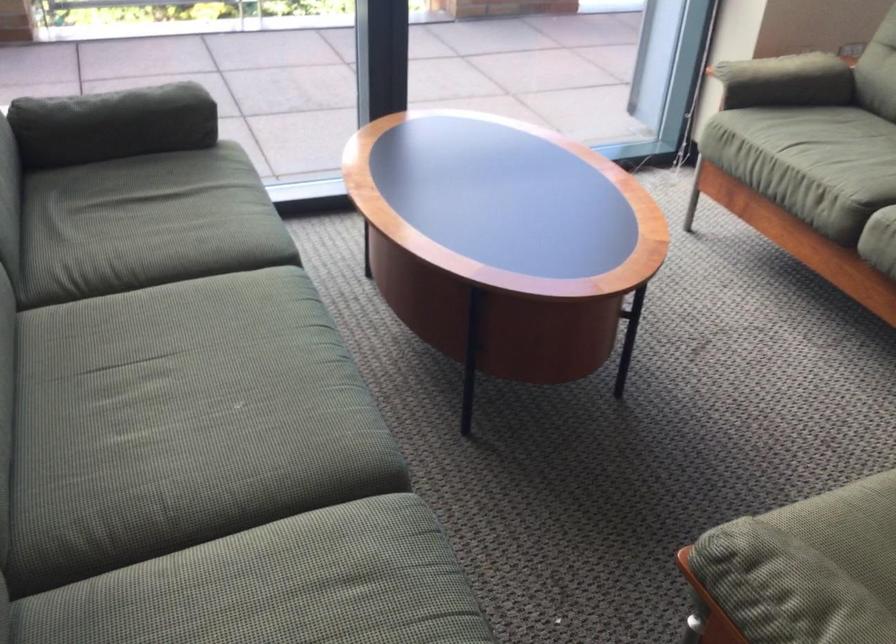
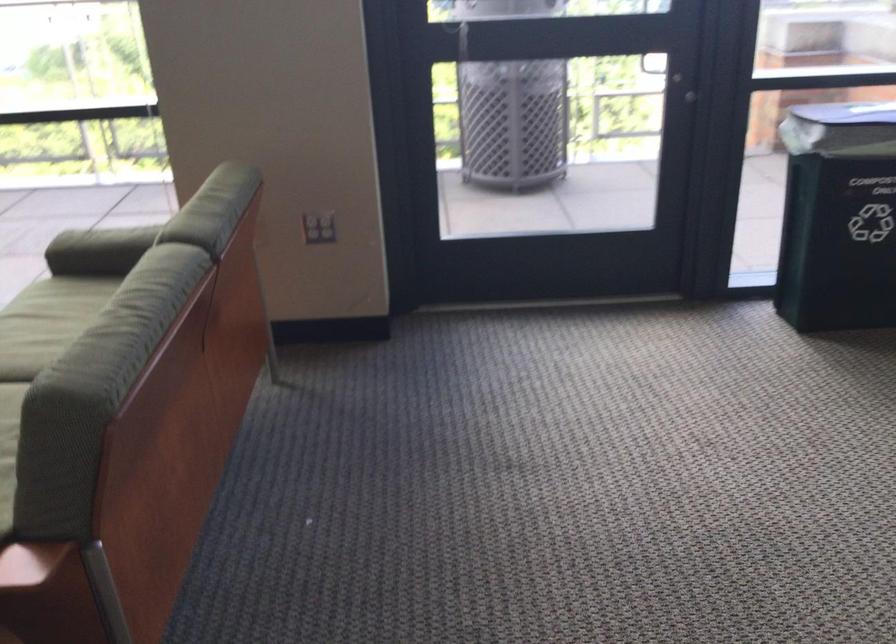
Question: Which direction would the cameraman need to move to produce the second image? Reply with the corresponding letter.

Choices:
 (A) Left
 (B) Right
 (C) Forward
 (D) Backward

Answer: (B)